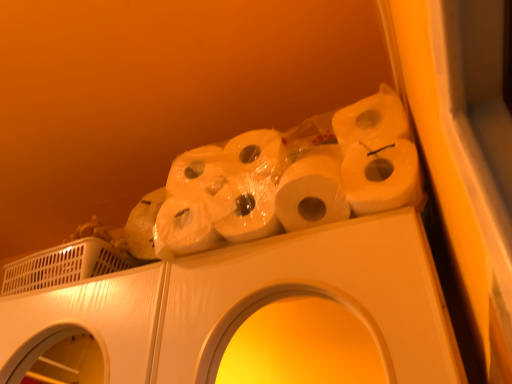
In order to face white plastic washing machine at upper left, should I rotate leftwards or rightwards?

You should look left and rotate roughly 23.682 degrees.

Image resolution: width=512 pixels, height=384 pixels. Describe the element at coordinates (79, 316) in the screenshot. I see `white plastic washing machine at upper left` at that location.

Image resolution: width=512 pixels, height=384 pixels. Identify the location of white plastic washing machine at upper left. (79, 316).

Image resolution: width=512 pixels, height=384 pixels. Identify the location of white matte toilet paper at upper center. (285, 180).

This screenshot has width=512, height=384. What do you see at coordinates (285, 180) in the screenshot?
I see `white matte toilet paper at upper center` at bounding box center [285, 180].

The width and height of the screenshot is (512, 384). I want to click on white plastic washing machine at upper left, so pyautogui.click(x=79, y=316).

Between white plastic washing machine at upper left and white matte toilet paper at upper center, which one appears on the left side from the viewer's perspective?

white plastic washing machine at upper left is more to the left.

Between white plastic washing machine at upper left and white matte toilet paper at upper center, which one is positioned behind?

white plastic washing machine at upper left is more distant.

Is point (23, 262) farther from viewer compared to point (132, 232)?

Yes, point (23, 262) is behind point (132, 232).

From the image's perspective, is white plastic washing machine at upper left under white matte toilet paper at upper center?

Indeed, from the image's perspective, white plastic washing machine at upper left is shown beneath white matte toilet paper at upper center.

From a real-world perspective, relative to white matte toilet paper at upper center, is white plastic washing machine at upper left vertically above or below?

white plastic washing machine at upper left is situated lower than white matte toilet paper at upper center in the real world.

Between white plastic washing machine at upper left and white matte toilet paper at upper center, which one has larger width?

With larger width is white plastic washing machine at upper left.

Consider the image. Which of these two, white plastic washing machine at upper left or white matte toilet paper at upper center, stands taller?

With more height is white matte toilet paper at upper center.

Between white plastic washing machine at upper left and white matte toilet paper at upper center, which one has larger size?

With larger size is white matte toilet paper at upper center.

Do you think white plastic washing machine at upper left is within white matte toilet paper at upper center, or outside of it?

white plastic washing machine at upper left is located beyond the bounds of white matte toilet paper at upper center.

Is white plastic washing machine at upper left not near white matte toilet paper at upper center?

They are positioned close to each other.

Is white plastic washing machine at upper left oriented away from white matte toilet paper at upper center?

No, white plastic washing machine at upper left's orientation is not away from white matte toilet paper at upper center.

How different are the orientations of white plastic washing machine at upper left and white matte toilet paper at upper center in degrees?

They differ by 0.00124 degrees in their facing directions.

At what (x,y) coordinates should I click in order to perform the action: click on washing machine lying on the left of white matte toilet paper at upper center. Please return your answer as a coordinate pair (x, y). The width and height of the screenshot is (512, 384). Looking at the image, I should click on (79, 316).

Can you confirm if white matte toilet paper at upper center is positioned to the left of white plastic washing machine at upper left?

In fact, white matte toilet paper at upper center is to the right of white plastic washing machine at upper left.

In the image, is white matte toilet paper at upper center positioned in front of or behind white plastic washing machine at upper left?

white matte toilet paper at upper center is in front of white plastic washing machine at upper left.

Which is in front, point (188, 235) or point (9, 324)?

The point (188, 235) is in front.

From the image's perspective, which object appears higher, white matte toilet paper at upper center or white plastic washing machine at upper left?

white matte toilet paper at upper center is shown above in the image.

From a real-world perspective, between white matte toilet paper at upper center and white plastic washing machine at upper left, who is vertically lower?

white plastic washing machine at upper left is physically lower.

Consider the image. Is white matte toilet paper at upper center wider or thinner than white plastic washing machine at upper left?

Clearly, white matte toilet paper at upper center has less width compared to white plastic washing machine at upper left.

Does white matte toilet paper at upper center have a lesser height compared to white plastic washing machine at upper left?

No, white matte toilet paper at upper center is not shorter than white plastic washing machine at upper left.

Which of these two, white matte toilet paper at upper center or white plastic washing machine at upper left, is smaller?

white plastic washing machine at upper left.

Can we say white matte toilet paper at upper center lies outside white plastic washing machine at upper left?

white matte toilet paper at upper center is positioned outside white plastic washing machine at upper left.

Are white matte toilet paper at upper center and white plastic washing machine at upper left far apart?

No.

Does white matte toilet paper at upper center turn towards white plastic washing machine at upper left?

No, white matte toilet paper at upper center is not oriented towards white plastic washing machine at upper left.

What's the angular difference between white matte toilet paper at upper center and white plastic washing machine at upper left's facing directions?

The facing directions of white matte toilet paper at upper center and white plastic washing machine at upper left are 0.00124 degrees apart.

How distant is white matte toilet paper at upper center from white plastic washing machine at upper left?

white matte toilet paper at upper center is 9.39 inches away from white plastic washing machine at upper left.

The width and height of the screenshot is (512, 384). What are the coordinates of `toilet paper in front of the white plastic washing machine at upper left` in the screenshot? It's located at pyautogui.click(x=285, y=180).

Locate an element on the screen. The height and width of the screenshot is (384, 512). toilet paper in front of the white plastic washing machine at upper left is located at coordinates (285, 180).

Identify the location of washing machine below the white matte toilet paper at upper center (from a real-world perspective). The image size is (512, 384). (79, 316).